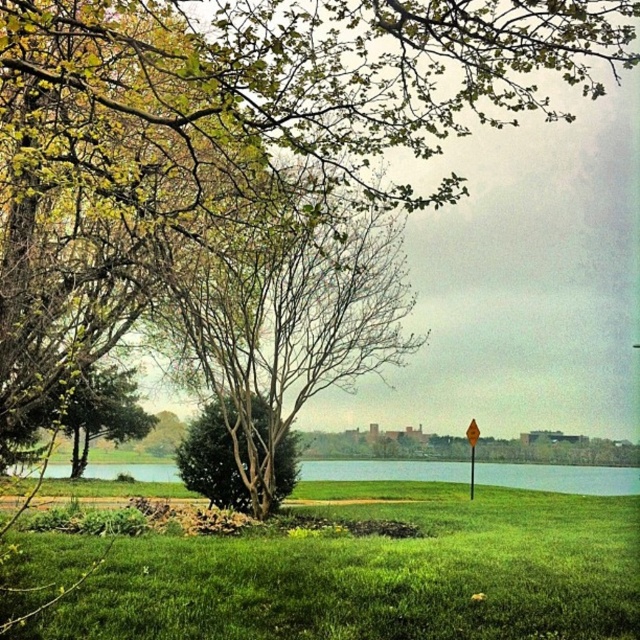
Question: Can you confirm if green grassy water at center is positioned to the right of yellow plastic street sign at upper center?

Choices:
 (A) no
 (B) yes

Answer: (A)

Question: Can you confirm if green leafy tree at left is wider than yellow reflective plastic at center?

Choices:
 (A) no
 (B) yes

Answer: (B)

Question: Based on their relative distances, which object is farther from the green leafy tree at left?

Choices:
 (A) yellow reflective plastic at center
 (B) yellow plastic street sign at upper center
 (C) green grassy at lower center

Answer: (B)

Question: Is green grassy water at center thinner than yellow plastic street sign at upper center?

Choices:
 (A) no
 (B) yes

Answer: (A)

Question: Which object is farther from the camera taking this photo?

Choices:
 (A) yellow plastic street sign at upper center
 (B) green grassy water at center

Answer: (B)

Question: Which of the following is the closest to the observer?

Choices:
 (A) (467, 429)
 (B) (268, 432)
 (C) (561, 584)
 (D) (472, 424)

Answer: (C)